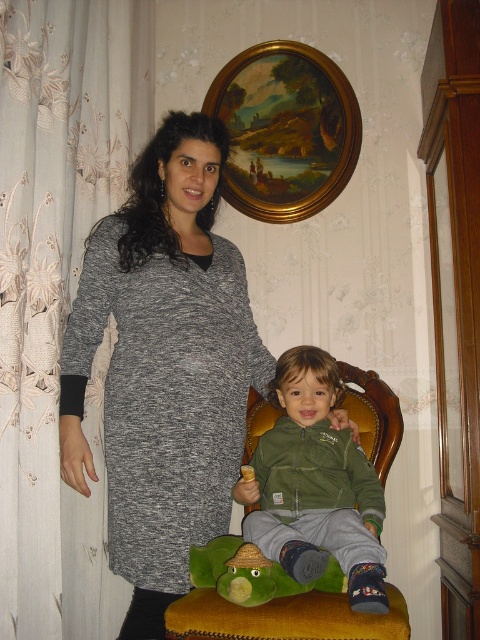
Question: Does oil painting at upper center have a larger size compared to green plush toy at lower center?

Choices:
 (A) no
 (B) yes

Answer: (B)

Question: Can you confirm if gray knit dress at left is thinner than green fleece jacket at center?

Choices:
 (A) yes
 (B) no

Answer: (B)

Question: Does green fleece jacket at center have a smaller size compared to green plush toy at lower center?

Choices:
 (A) no
 (B) yes

Answer: (A)

Question: Estimate the real-world distances between objects in this image. Which object is closer to the white lace curtain at left?

Choices:
 (A) oil painting at upper center
 (B) gray knit dress at left
 (C) green fleece jacket at center

Answer: (B)

Question: Among these points, which one is farthest from the camera?

Choices:
 (A) (343, 588)
 (B) (26, 134)
 (C) (82, 326)
 (D) (301, 211)

Answer: (D)

Question: Among these points, which one is nearest to the camera?

Choices:
 (A) click(276, 388)
 (B) click(272, 358)

Answer: (A)